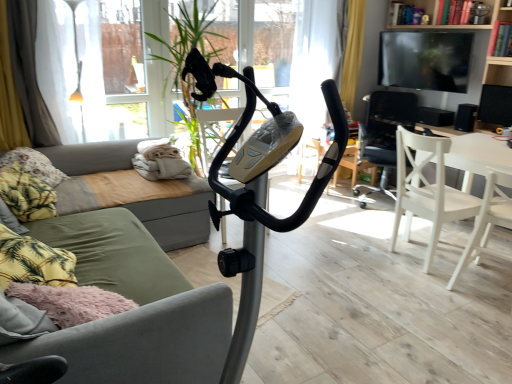
Question: Are black matte speaker at right, which is the 2th speaker in back-to-front order, and white wood chair at center right, which is the first chair in back-to-front order, located far from each other?

Choices:
 (A) yes
 (B) no

Answer: (B)

Question: Is black matte speaker at right, the second speaker in the front-to-back sequence, outside white wood chair at center right, marked as the third chair in a front-to-back arrangement?

Choices:
 (A) no
 (B) yes

Answer: (B)

Question: From the image's perspective, would you say black matte speaker at right, which is the 2th speaker in back-to-front order, is shown under white wood chair at center right, which is the first chair in back-to-front order?

Choices:
 (A) yes
 (B) no

Answer: (B)

Question: From a real-world perspective, does black matte speaker at right, the second speaker in the front-to-back sequence, stand above white wood chair at center right, marked as the third chair in a front-to-back arrangement?

Choices:
 (A) no
 (B) yes

Answer: (B)

Question: From the image's perspective, is black matte speaker at right, which is the 2th speaker in back-to-front order, on white wood chair at center right, marked as the third chair in a front-to-back arrangement?

Choices:
 (A) yes
 (B) no

Answer: (A)

Question: Can you confirm if black matte speaker at right, which is the 2th speaker in back-to-front order, is smaller than white wood chair at center right, marked as the third chair in a front-to-back arrangement?

Choices:
 (A) no
 (B) yes

Answer: (B)

Question: Is white wood chair at right, acting as the 3th chair starting from the back, positioned before black matte speaker at right, which is the 2th speaker in back-to-front order?

Choices:
 (A) yes
 (B) no

Answer: (A)

Question: Does white wood chair at right, acting as the 3th chair starting from the back, have a greater width compared to black matte speaker at right, the second speaker in the front-to-back sequence?

Choices:
 (A) yes
 (B) no

Answer: (A)

Question: Can black matte speaker at right, the second speaker in the front-to-back sequence, be found inside white wood chair at right, acting as the 3th chair starting from the back?

Choices:
 (A) yes
 (B) no

Answer: (B)

Question: From a real-world perspective, is white wood chair at right, acting as the first chair starting from the front, located higher than black matte speaker at right, the second speaker in the front-to-back sequence?

Choices:
 (A) no
 (B) yes

Answer: (A)

Question: Is white wood chair at right, acting as the 3th chair starting from the back, shorter than black matte speaker at right, the second speaker in the front-to-back sequence?

Choices:
 (A) no
 (B) yes

Answer: (A)

Question: Does white wood chair at right, acting as the first chair starting from the front, have a lesser width compared to black matte speaker at right, the second speaker in the front-to-back sequence?

Choices:
 (A) no
 (B) yes

Answer: (A)

Question: Can we say wooden bookshelf at upper right lies outside green fabric couch at center?

Choices:
 (A) yes
 (B) no

Answer: (A)